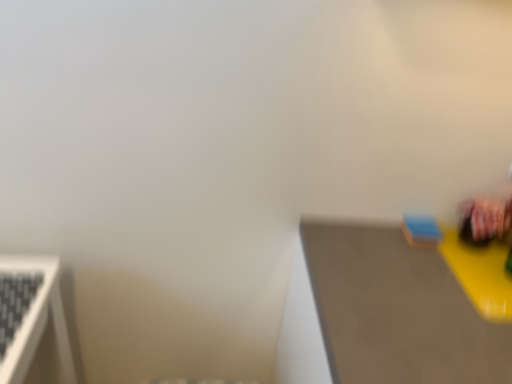
At what (x,y) coordinates should I click in order to perform the action: click on free space to the left of blue matte sponge at upper right, which is the first toy in left-to-right order. Please return your answer as a coordinate pair (x, y). Image resolution: width=512 pixels, height=384 pixels. Looking at the image, I should click on (368, 238).